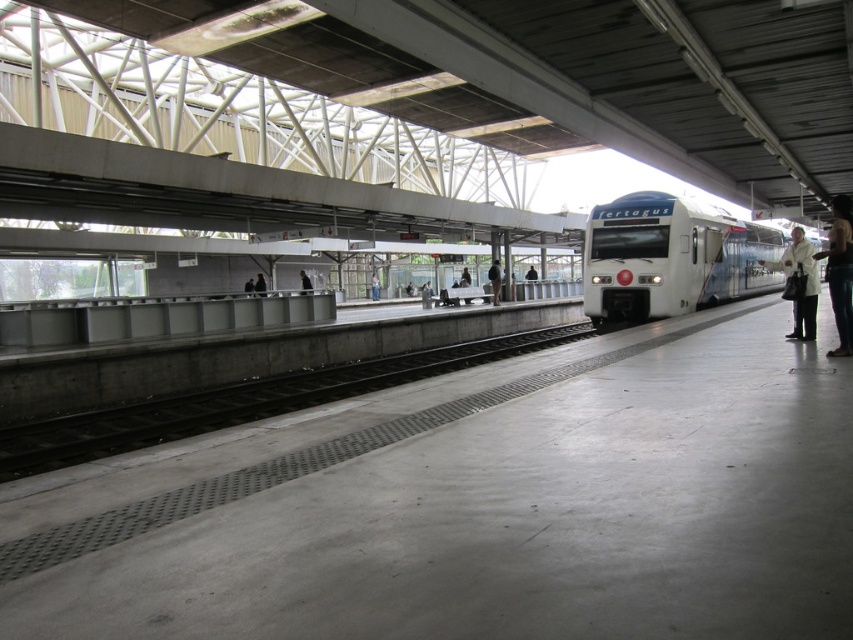
You are standing on the train station platform and want to board the white glossy train at center. Based on the coordinates provided, is the train located closer to the front or back of the platform?

The white glossy train at center is located at coordinates point (x=671, y=257). Since the coordinate system places (x=0, y=0) at the bottom left corner and (x=852, y=639) at the top right corner, the train is closer to the bottom right of the image, which corresponds to the front of the platform. Therefore, the train is located closer to the front of the platform.

You are standing on the platform at the modern train station and want to determine the distance between the two points marked on the platform. The first point is at coordinate point (x=691, y=244) and the second is at point (x=306, y=276). Given that the platform is 100 meters long, can you estimate which point is closer to the train labeled fertagus?

Point (x=691, y=244) is closer to the viewer than point (x=306, y=276). Since the train is at the far end of the platform facing the camera, the point closer to the viewer would be farther from the train. Therefore, point (x=306, y=276) is closer to the fertagus train.